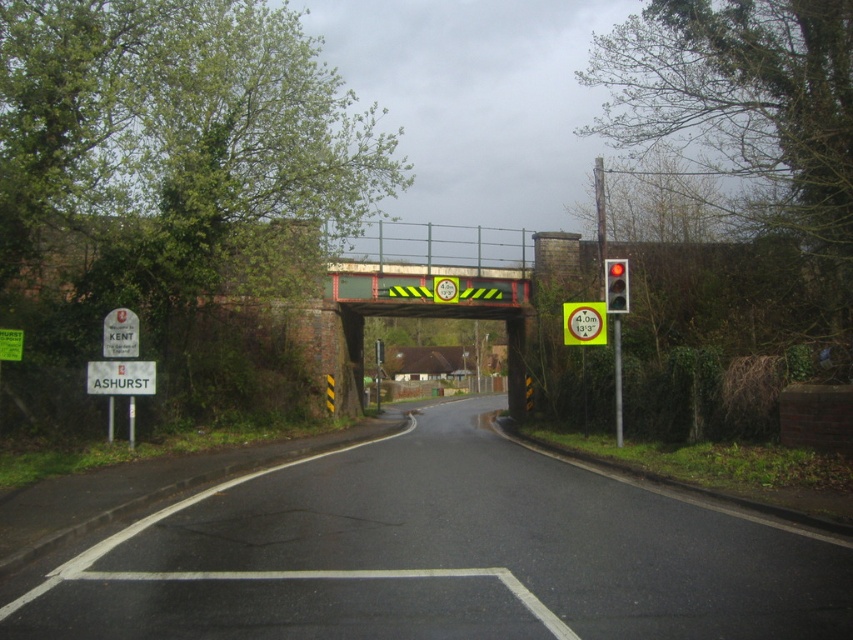
You are driving a truck that is 4 meters long and needs to navigate between the white plastic sign at lower left and the metallic rectangular sign at left. Can you safely pass through the space between them without hitting either sign?

The distance between the white plastic sign at lower left and the metallic rectangular sign at left is 41.16 centimeters. Since the truck is 4 meters long, which is significantly longer than the available space, it cannot safely pass through the space between them without hitting the signs.

Based on the photo, you are driving a truck and need to pass under the railway bridge. You see the metallic rectangular sign at left and the red glass traffic light at right. Which object is closer to your truck as you approach the bridge?

The metallic rectangular sign at left is in front of the red glass traffic light at right, so it is closer to your truck as you approach the bridge.

You are driving a tall truck and approaching the railway bridge. You notice two signs ahead on the road. One is the yellow reflective circle at upper center and the other is the metallic rectangular sign at left. According to their positions, which sign should you pay attention to first?

The yellow reflective circle at upper center is above the metallic rectangular sign at left, so you should pay attention to the yellow reflective circle at upper center first as it is positioned higher and likely indicates an immediate height restriction warning.